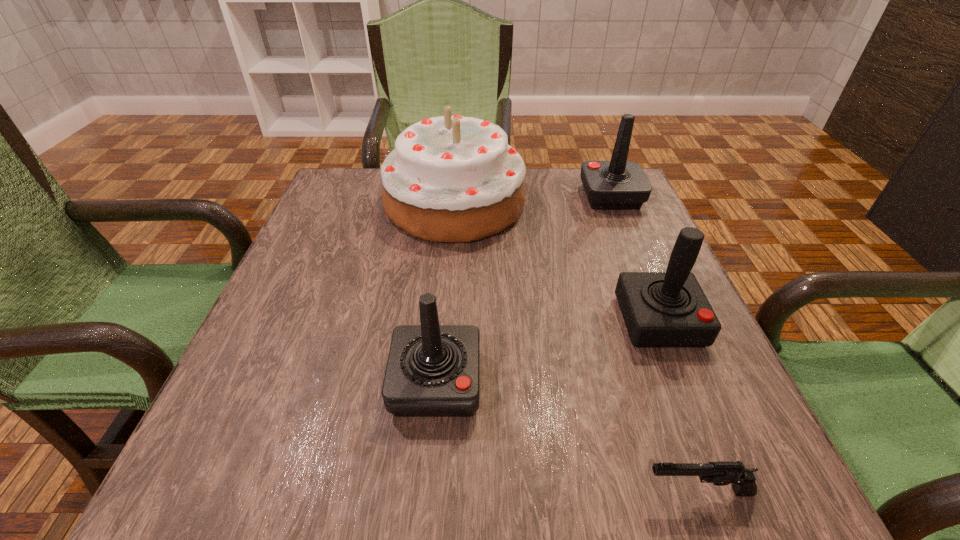
In order to click on object that is the nearest to the gun in this screenshot , I will do `click(660, 309)`.

The height and width of the screenshot is (540, 960). What are the coordinates of `the closest joystick to the farthest joystick` in the screenshot? It's located at (660, 309).

Identify the location of the closest joystick to the leftmost joystick. The width and height of the screenshot is (960, 540). (660, 309).

This screenshot has width=960, height=540. Identify the location of free space that satisfies the following two spatial constraints: 1. on the back side of the farthest joystick; 2. on the left side of the cake. (455, 197).